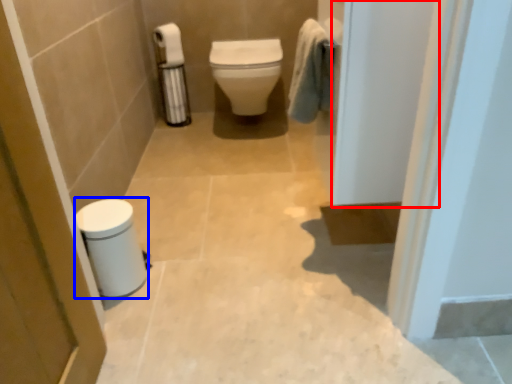
Question: Among these objects, which one is nearest to the camera, screen door (highlighted by a red box) or porcelain (highlighted by a blue box)?

Choices:
 (A) screen door
 (B) porcelain

Answer: (A)